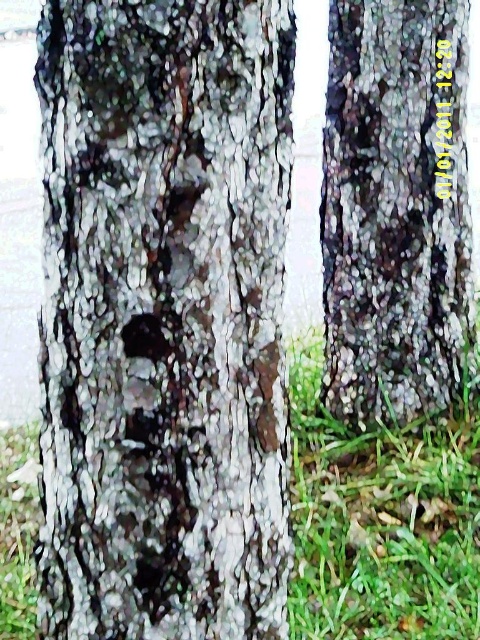
You are a hiker trying to identify landmarks. You see the dark gray bark tree at right and the green grass at center. Which one is smaller in size?

The dark gray bark tree at right has a smaller size compared to the green grass at center, so the dark gray bark tree at right is smaller.

You are a hiker with a camera that has a 5 feet minimum focus distance. You want to take a closeup photo of the dark gray bark tree at right. Can you focus on it?

The dark gray bark tree at right is 6.92 feet away from the camera, which is beyond the 5 feet minimum focus distance. Therefore, the camera can focus on it.

You are a bird looking for a nesting spot. You see the dark gray bark tree trunk at center and the dark gray bark tree at right. Which tree has a cavity that could be suitable for nesting?

The dark gray bark tree trunk at center has a noticeable circular hole or cavity near its center, making it suitable for nesting.